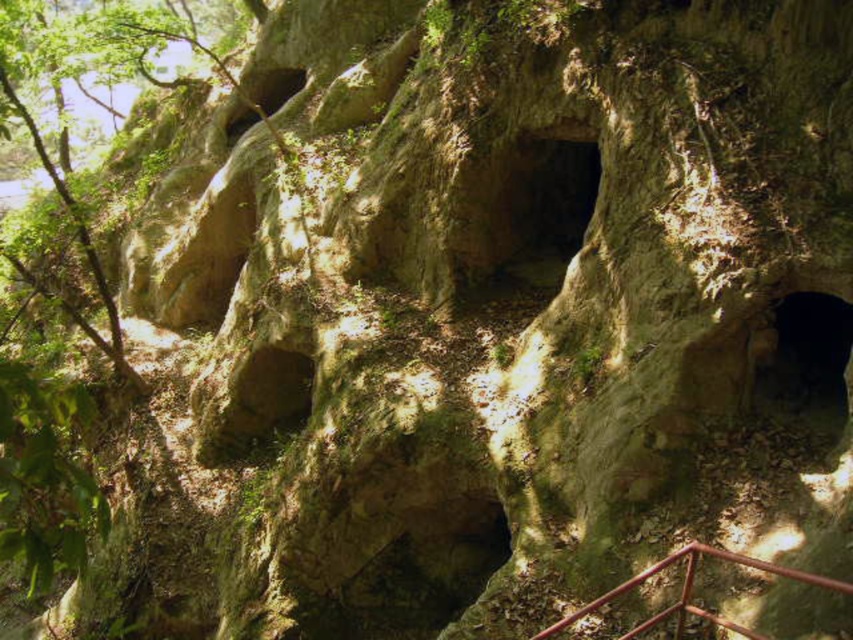
Question: Is dark brown stone cave at lower right above red metal railing at lower right?

Choices:
 (A) yes
 (B) no

Answer: (A)

Question: Is dark brown stone cave at lower right thinner than red metal railing at lower right?

Choices:
 (A) yes
 (B) no

Answer: (A)

Question: Among these points, which one is nearest to the camera?

Choices:
 (A) (780, 310)
 (B) (755, 634)

Answer: (B)

Question: Which point is closer to the camera?

Choices:
 (A) (648, 621)
 (B) (779, 419)

Answer: (A)

Question: Does dark brown stone cave at lower right appear over red metal railing at lower right?

Choices:
 (A) yes
 (B) no

Answer: (A)